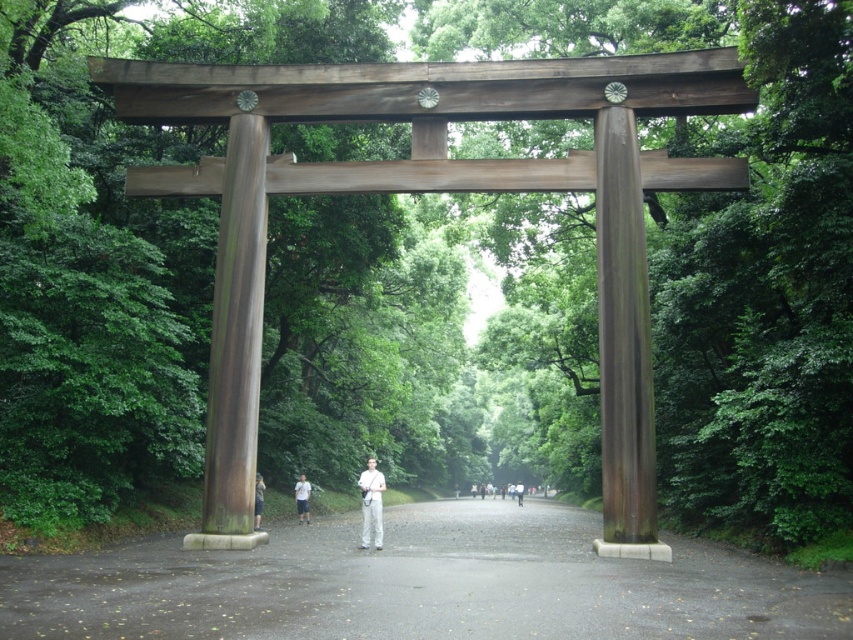
You are a delivery person carrying a package that is 20 feet long. You need to pass through the area between the dull gray asphalt at center and the glossy wood pillar at center. Can your package fit through the space between them?

The distance between the dull gray asphalt at center and the glossy wood pillar at center is 18.07 feet. Since the package is 20 feet long, it is longer than the available space, so the package cannot fit through the space between them.

You are a photographer standing at the entrance of the pathway. You want to take a photo that includes both the glossy wood pillar at center and the light gray fabric pants at center. Based on their positions, which object will appear closer to the camera in the photo?

The glossy wood pillar at center is in front of the light gray fabric pants at center, so it will appear closer to the camera in the photo.

You are a visitor walking along the pathway and notice the glossy wood pillar at center and the light gray pants at center. Which object is located higher relative to the other?

The glossy wood pillar at center is positioned over light gray pants at center, meaning it is higher.